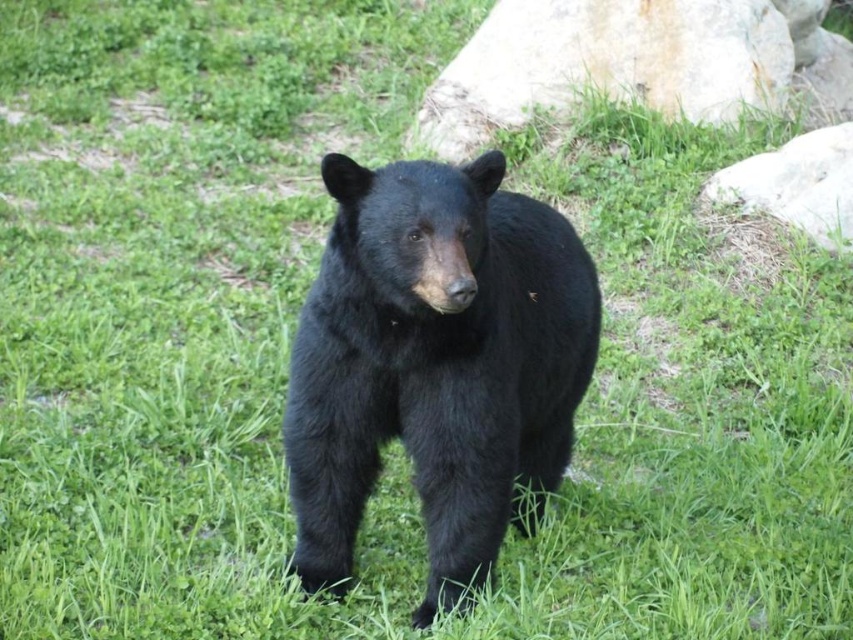
Does black furry bear at center have a smaller size compared to gray rock at upper right?

Correct, black furry bear at center occupies less space than gray rock at upper right.

Is black furry bear at center thinner than gray rock at upper right?

Yes, black furry bear at center is thinner than gray rock at upper right.

Locate an element on the screen. black furry bear at center is located at coordinates (434, 364).

Where is `black furry bear at center`? The image size is (853, 640). black furry bear at center is located at coordinates pyautogui.click(x=434, y=364).

Is gray rock at upper right in front of white smooth rock at right?

No, it is not.

Between point (585, 26) and point (772, 156), which one is positioned behind?

Positioned behind is point (585, 26).

Which is behind, point (460, 157) or point (821, 189)?

Point (460, 157)

I want to click on gray rock at upper right, so click(606, 65).

Can you confirm if black furry bear at center is positioned to the right of white smooth rock at right?

In fact, black furry bear at center is to the left of white smooth rock at right.

Can you confirm if black furry bear at center is thinner than white smooth rock at right?

No, black furry bear at center is not thinner than white smooth rock at right.

What are the coordinates of `black furry bear at center` in the screenshot? It's located at (434, 364).

Locate an element on the screen. This screenshot has width=853, height=640. black furry bear at center is located at coordinates (434, 364).